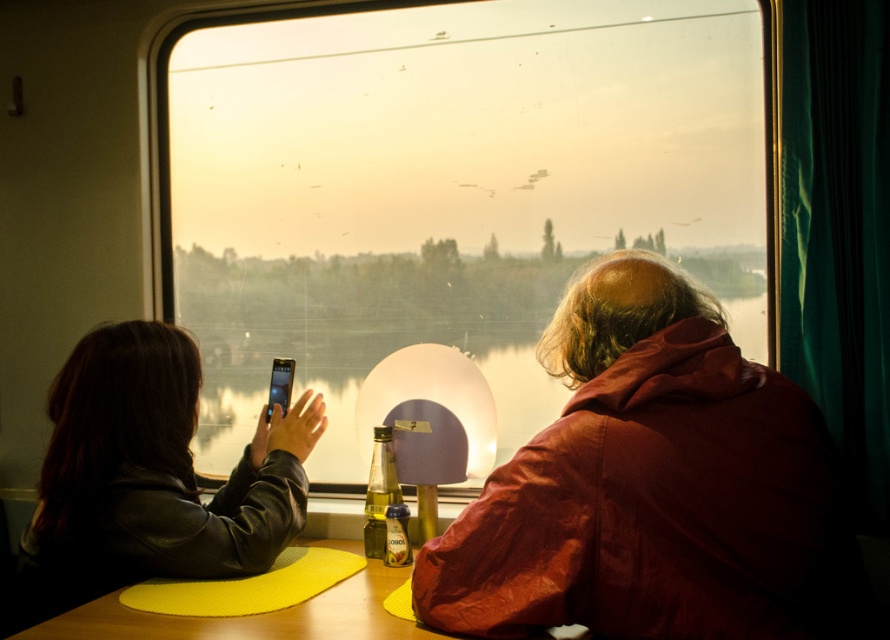
You are a photographer who needs to reach your camera from where you are standing next to the leather jacket at left. Can you comfortably reach it without moving your feet? The average arm length for an adult is about 0.7 meters.

The distance between the leather jacket at left and the camera is 1.65 meters. Since the average adult arm length is 0.7 meters, you cannot comfortably reach the camera without moving your feet.

You are standing in the train compartment and want to borrow a jacket from the person at the left. Where exactly is the leather jacket at left located in the scene?

The leather jacket at left is located at point (151, 476).